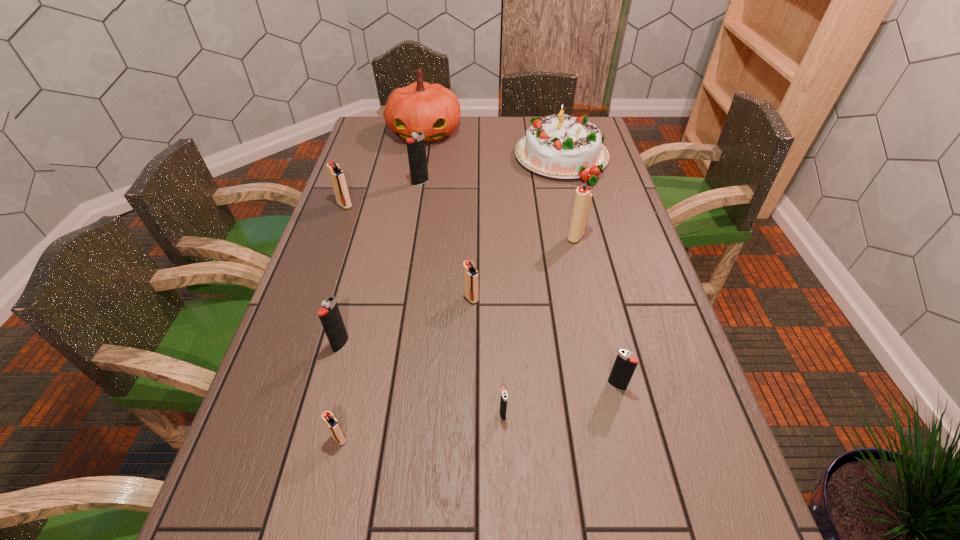
Identify the location of the tallest object. (432, 109).

Find the location of `pumpkin`. pumpkin is located at coordinates (432, 109).

This screenshot has height=540, width=960. I want to click on cake, so click(562, 146).

Locate an element on the screen. The height and width of the screenshot is (540, 960). the third nearest red igniter is located at coordinates (583, 195).

The image size is (960, 540). What are the coordinates of `the biggest red igniter` in the screenshot? It's located at (583, 195).

Identify the location of the farthest igniter. [416, 149].

Where is `the biggest black igniter`? The width and height of the screenshot is (960, 540). the biggest black igniter is located at coordinates coord(416,149).

The image size is (960, 540). I want to click on the third smallest red igniter, so click(337, 176).

Where is `the leftmost object`? The height and width of the screenshot is (540, 960). the leftmost object is located at coordinates (337, 176).

Where is `the third smallest black igniter`? The image size is (960, 540). the third smallest black igniter is located at coordinates (330, 317).